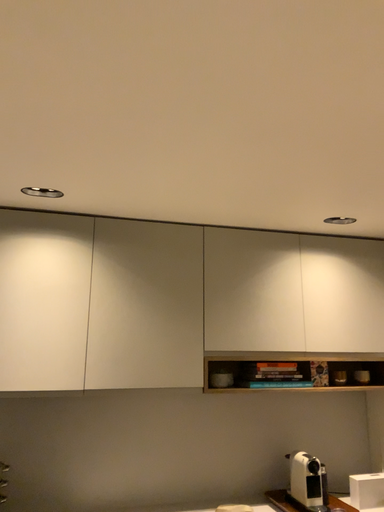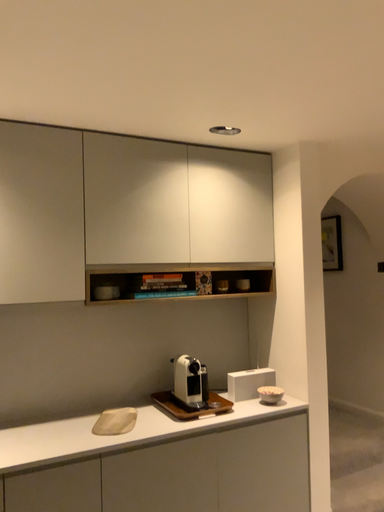
Question: How did the camera likely rotate when shooting the video?

Choices:
 (A) rotated right
 (B) rotated left

Answer: (A)